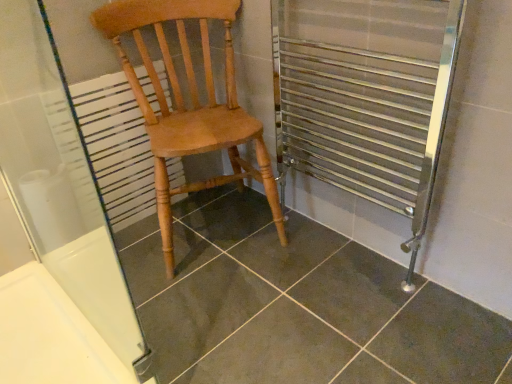
Locate an element on the screen. The image size is (512, 384). vacant area that lies between light brown wood chair at center and white textured radiator at left is located at coordinates (126, 250).